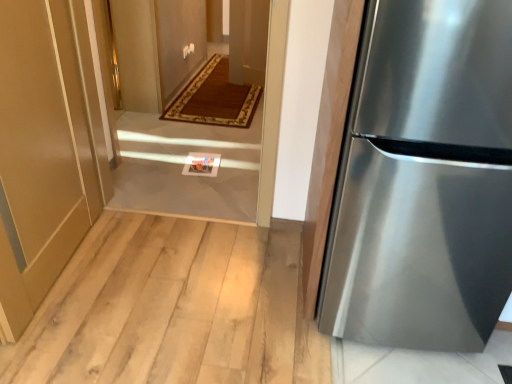
This screenshot has width=512, height=384. I want to click on vacant point to the right of matte gold door at lower left, so click(156, 273).